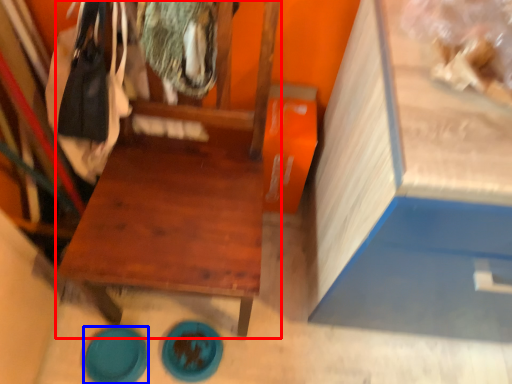
Question: Which of the following is the farthest to the observer, furniture (highlighted by a red box) or plate (highlighted by a blue box)?

Choices:
 (A) furniture
 (B) plate

Answer: (B)